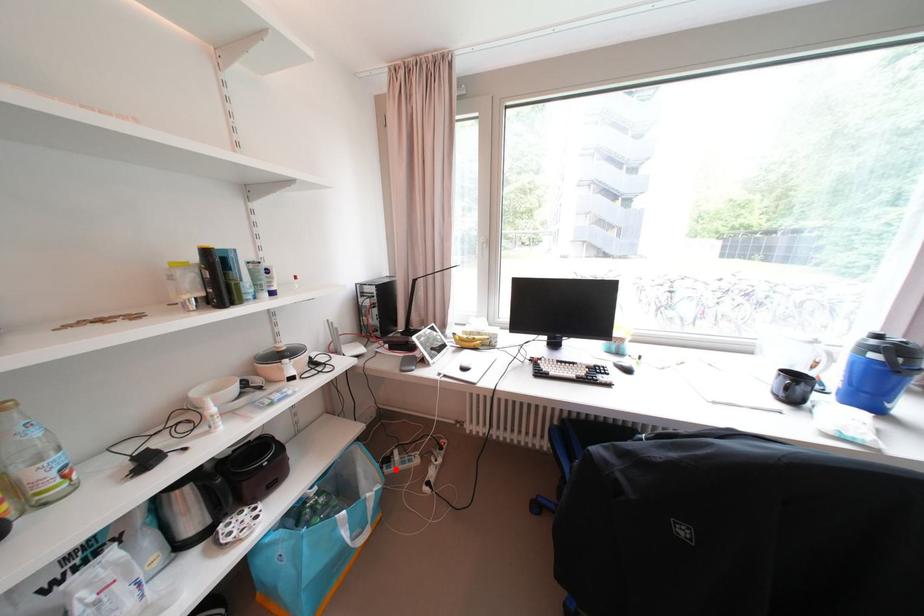
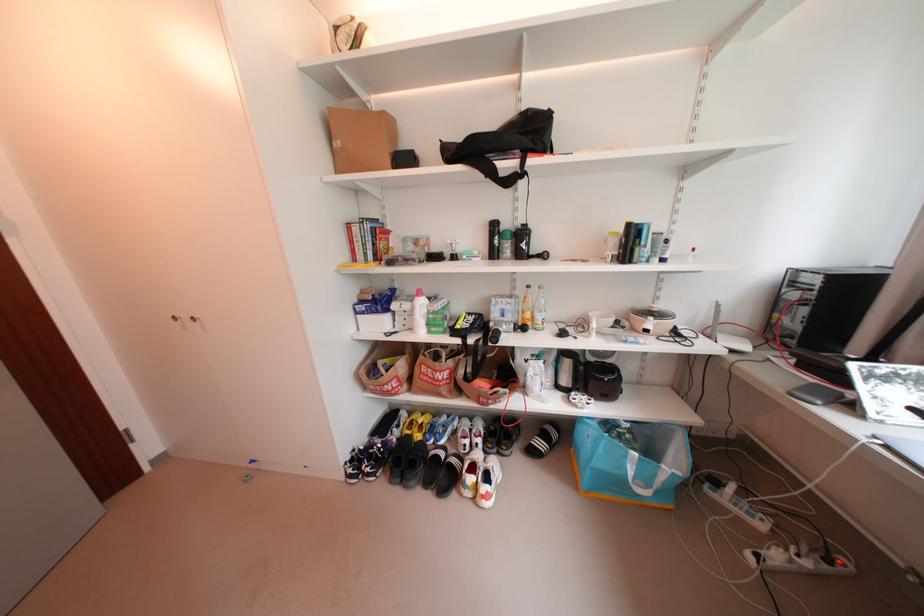
Locate, in the second image, the point that corresponds to the highlighted location in the first image.

(719, 490)